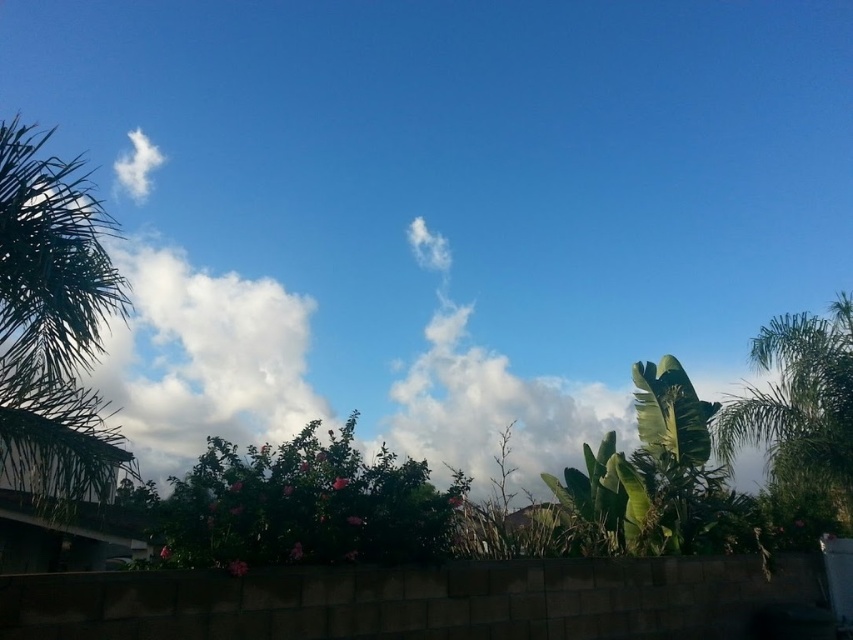
You are planning to install a small garden path between the green leafy palm tree at left and the green leafy palm tree at right. The path will be 10 meters long. Based on the scene, will the path fit between the two palm trees?

The distance between the green leafy palm tree at left and the green leafy palm tree at right is 10.60 meters. Since the path is only 10 meters long, there will be enough space to fit it between them with 0.60 meters of extra space remaining.

You are planning to place a small garden statue between the green leafy palm tree at left and the green leafy bush at center. Which side of the path between them should you place it so it doesn

The green leafy palm tree at left is wider than the green leafy bush at center. Therefore, placing the statue closer to the green leafy bush at center would ensure it is more centered between the two plants.

You are planning to install a small garden bench between the green leafy palm tree at left and the green leafy bush at center. The bench requires 4 meters of space to be placed comfortably. Based on the scene, will there be enough space for the bench?

The green leafy palm tree at left and green leafy bush at center are 3.92 meters apart from each other. Since the required space for the bench is 4 meters, there is insufficient space to place the bench comfortably between them.